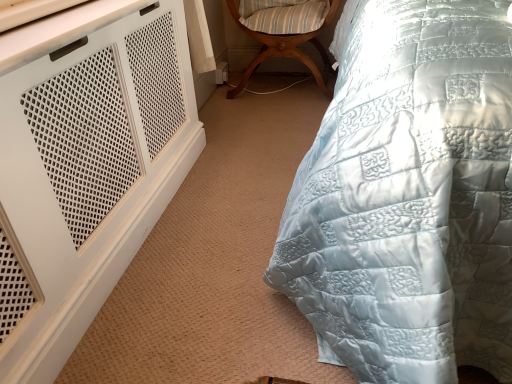
Question: In the image, is light blue quilted fabric at center on the left side or the right side of wooden striped cushioned chair at center?

Choices:
 (A) right
 (B) left

Answer: (A)

Question: Is light blue quilted fabric at center in front of or behind wooden striped cushioned chair at center in the image?

Choices:
 (A) behind
 (B) front

Answer: (B)

Question: Looking at the image, does light blue quilted fabric at center seem bigger or smaller compared to wooden striped cushioned chair at center?

Choices:
 (A) small
 (B) big

Answer: (B)

Question: Is wooden striped cushioned chair at center taller or shorter than light blue quilted fabric at center?

Choices:
 (A) tall
 (B) short

Answer: (B)

Question: Is wooden striped cushioned chair at center bigger or smaller than light blue quilted fabric at center?

Choices:
 (A) small
 (B) big

Answer: (A)

Question: In the image, is wooden striped cushioned chair at center positioned in front of or behind light blue quilted fabric at center?

Choices:
 (A) front
 (B) behind

Answer: (B)

Question: Is point (288, 23) closer or farther from the camera than point (352, 130)?

Choices:
 (A) farther
 (B) closer

Answer: (A)